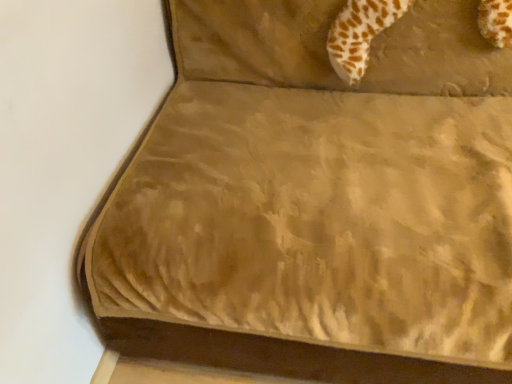
What is the approximate width of spotted fabric giraffe at upper right?

spotted fabric giraffe at upper right is 11.44 inches wide.

Describe the element at coordinates (360, 34) in the screenshot. I see `spotted fabric giraffe at upper right` at that location.

Locate an element on the screen. This screenshot has height=384, width=512. spotted fabric giraffe at upper right is located at coordinates 360,34.

Locate an element on the screen. spotted fabric giraffe at upper right is located at coordinates (360, 34).